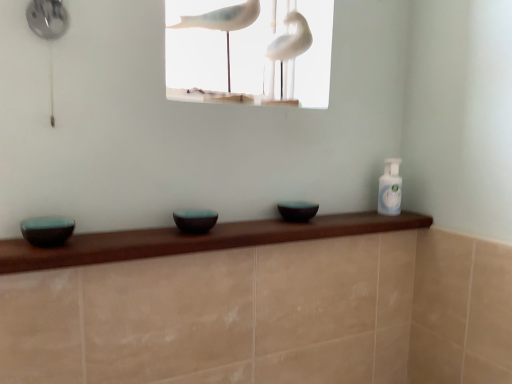
Question: From a real-world perspective, is matte black bowl at center, which is counted as the 2th basin, starting from the left, on white glossy bird at upper center?

Choices:
 (A) yes
 (B) no

Answer: (B)

Question: Considering the relative sizes of matte black bowl at center, the second basin positioned from the front, and white glossy bird at upper center in the image provided, is matte black bowl at center, the second basin positioned from the front, thinner than white glossy bird at upper center?

Choices:
 (A) no
 (B) yes

Answer: (B)

Question: Does matte black bowl at center, the second basin positioned from the front, have a larger size compared to white glossy bird at upper center?

Choices:
 (A) yes
 (B) no

Answer: (B)

Question: Is matte black bowl at center, the 2th basin viewed from the right, outside of white glossy bird at upper center?

Choices:
 (A) yes
 (B) no

Answer: (A)

Question: From a real-world perspective, is matte black bowl at center, which is counted as the 2th basin, starting from the left, physically below white glossy bird at upper center?

Choices:
 (A) no
 (B) yes

Answer: (B)

Question: From their relative heights in the image, would you say white glossy bird at upper center is taller or shorter than clear plastic bottle at upper right?

Choices:
 (A) tall
 (B) short

Answer: (A)

Question: Considering the positions of white glossy bird at upper center and clear plastic bottle at upper right in the image, is white glossy bird at upper center bigger or smaller than clear plastic bottle at upper right?

Choices:
 (A) small
 (B) big

Answer: (B)

Question: Do you think white glossy bird at upper center is within clear plastic bottle at upper right, or outside of it?

Choices:
 (A) inside
 (B) outside

Answer: (B)

Question: Looking at their shapes, would you say white glossy bird at upper center is wider or thinner than clear plastic bottle at upper right?

Choices:
 (A) thin
 (B) wide

Answer: (B)

Question: Considering the positions of clear plastic bottle at upper right and matte black bowl at center, which appears as the 2th basin when viewed from the back, in the image, is clear plastic bottle at upper right bigger or smaller than matte black bowl at center, which appears as the 2th basin when viewed from the back,?

Choices:
 (A) big
 (B) small

Answer: (A)

Question: From the image's perspective, is clear plastic bottle at upper right above or below matte black bowl at center, which appears as the 2th basin when viewed from the back?

Choices:
 (A) below
 (B) above

Answer: (B)

Question: Would you say clear plastic bottle at upper right is to the left or to the right of matte black bowl at center, the second basin positioned from the front, in the picture?

Choices:
 (A) left
 (B) right

Answer: (B)

Question: In the image, is clear plastic bottle at upper right positioned in front of or behind matte black bowl at center, which is counted as the 2th basin, starting from the left?

Choices:
 (A) behind
 (B) front

Answer: (A)

Question: Choose the correct answer: Is white matte birds at upper center inside white glossy bird at upper center or outside it?

Choices:
 (A) outside
 (B) inside

Answer: (A)

Question: Visually, is white matte birds at upper center positioned to the left or to the right of white glossy bird at upper center?

Choices:
 (A) left
 (B) right

Answer: (A)